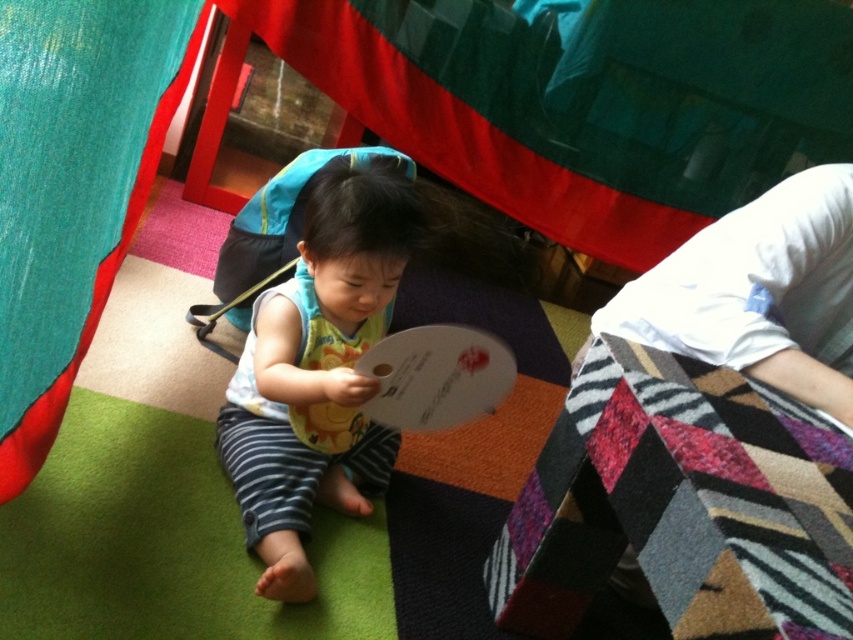
You are a parent looking for a bib for your child. You see the multicolored woven quilt at lower right and the matte white bib at center. Which one is closer to the center of the room?

The matte white bib at center is closer to the center of the room because it is positioned at the center, while the multicolored woven quilt at lower right is to the right of it.

You are a parent trying to decide where to place a new toy box in the play area. The toy box is 1.2 meters tall. The multicolored woven quilt at lower right and the matte white bib at center are already in the space. Based on their heights, can the toy box be placed between them without blocking the view of either object?

The multicolored woven quilt at lower right is not as tall as the matte white bib at center. Since the toy box is 1.2 meters tall, it depends on the actual heights of both objects. However, since the quilt is shorter than the bib, placing the toy box between them might block the view of the shorter quilt if the bib is taller. Without specific measurements, it is uncertain.

You are a parent trying to take a photo of your child playing with the multicolored woven quilt at lower right. You have a camera that requires a minimum distance of 25 inches to focus properly. Can you take the photo from where you are standing?

The multicolored woven quilt at lower right and camera are 27.80 inches apart, which is more than the 25 inches required for the camera to focus. Therefore, you can take the photo from your current position.